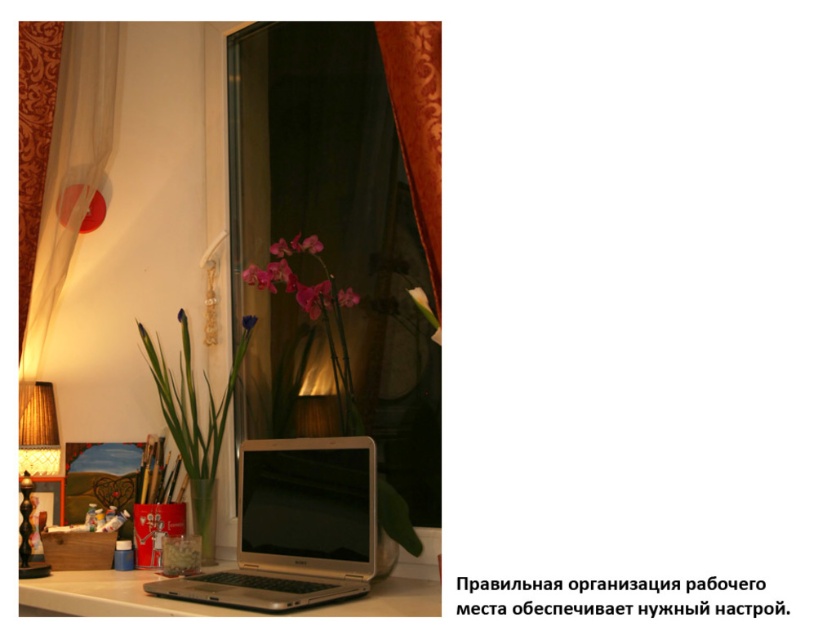
Question: Does wooden textured lampshade at left appear on the right side of pink matte orchid at center?

Choices:
 (A) yes
 (B) no

Answer: (B)

Question: Which of these objects is positioned closest to the white glossy table at lower center?

Choices:
 (A) velvet-like burgundy curtain at right
 (B) transparent glass window at center

Answer: (B)

Question: Which of the following is the closest to the observer?

Choices:
 (A) transparent glass window at center
 (B) satin silver laptop at center

Answer: (B)

Question: Among these points, which one is farthest from the camera?

Choices:
 (A) (320, 312)
 (B) (34, 448)

Answer: (B)

Question: Is transparent glass window at center positioned before pink matte orchid at center?

Choices:
 (A) yes
 (B) no

Answer: (A)

Question: From the image, what is the correct spatial relationship of velvet-like burgundy curtain at right in relation to pink matte orchid at center?

Choices:
 (A) right
 (B) left

Answer: (A)